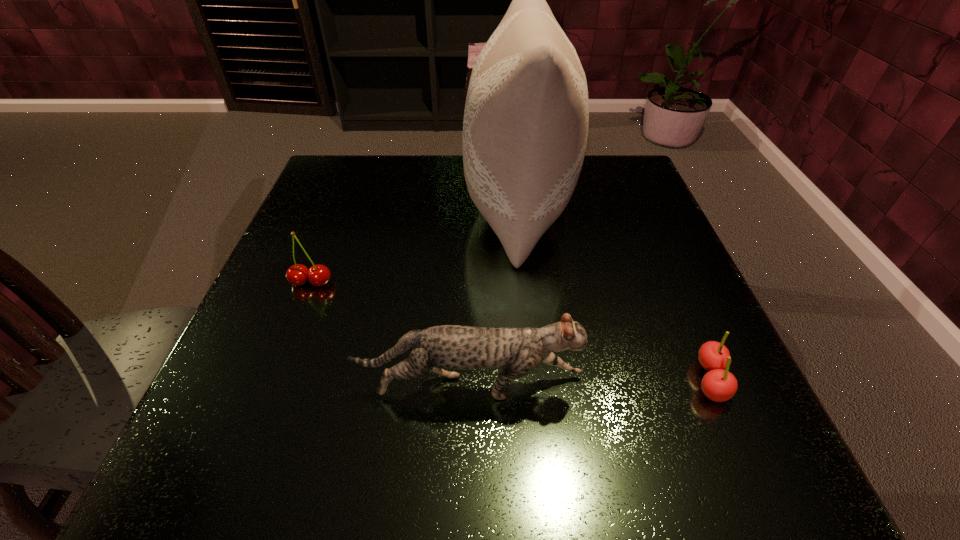
Locate which object ranks in proximity to the second tallest object. Please provide its 2D coordinates. Your answer should be formatted as a tuple, i.e. [(x, y)], where the tuple contains the x and y coordinates of a point satisfying the conditions above.

[(718, 384)]

Find the location of a particular element. This screenshot has width=960, height=540. vacant space that satisfies the following two spatial constraints: 1. with the stems of the rightmost object pointing upwards; 2. on the left side of the third tallest object is located at coordinates [x=274, y=380].

You are a GUI agent. You are given a task and a screenshot of the screen. Output one action in this format:
    pyautogui.click(x=<x>, y=<y>)
    Task: Click on the vacant area in the image that satisfies the following two spatial constraints: 1. on the front side of the tallest object; 2. with the stems of the second shortest object pointing upwards
    
    Given the screenshot: What is the action you would take?
    (526, 282)

Where is `free location that satisfies the following two spatial constraints: 1. on the front side of the tallest object; 2. with the stems of the taller cherry pointing upwards`? free location that satisfies the following two spatial constraints: 1. on the front side of the tallest object; 2. with the stems of the taller cherry pointing upwards is located at coordinates (526, 282).

Where is `blank area in the image that satisfies the following two spatial constraints: 1. on the front side of the tallest object; 2. with the stems of the leftmost object pointing upwards`? blank area in the image that satisfies the following two spatial constraints: 1. on the front side of the tallest object; 2. with the stems of the leftmost object pointing upwards is located at coordinates (526, 282).